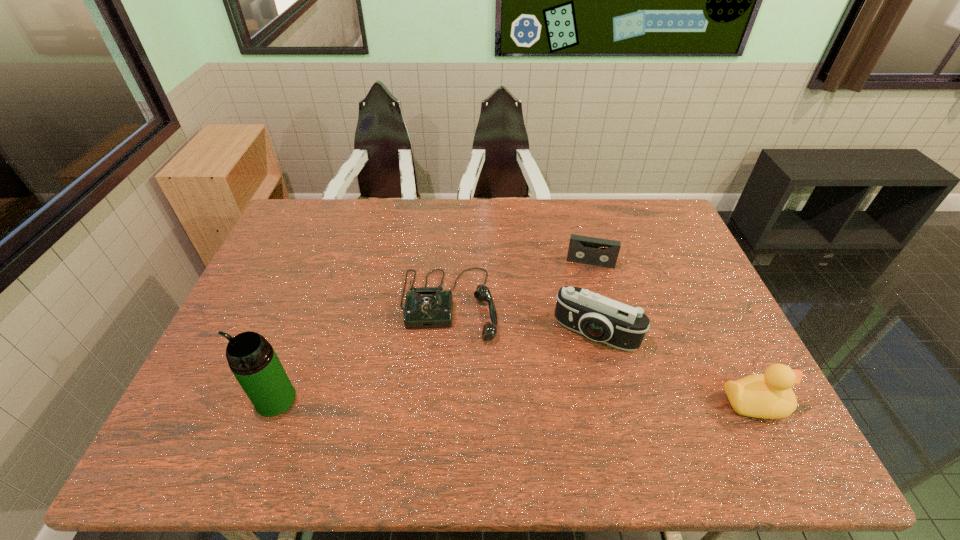
You are a GUI agent. You are given a task and a screenshot of the screen. Output one action in this format:
    pyautogui.click(x=<x>, y=<y>)
    Task: Click on the duck that is positioned at the near edge
    
    Given the screenshot: What is the action you would take?
    pyautogui.click(x=769, y=395)

Locate an element on the screen. This screenshot has height=540, width=960. object present at the left edge is located at coordinates (251, 358).

Locate an element on the screen. object present at the right edge is located at coordinates point(769,395).

Identify the location of object at the near left corner. The height and width of the screenshot is (540, 960). (251, 358).

Locate an element on the screen. The width and height of the screenshot is (960, 540). object that is at the near right corner is located at coordinates (769, 395).

In the image, there is a desktop. Identify the location of vacant space at the far edge. Image resolution: width=960 pixels, height=540 pixels. (439, 228).

Locate an element on the screen. This screenshot has width=960, height=540. free location at the near edge is located at coordinates click(574, 386).

This screenshot has height=540, width=960. In the image, there is a desktop. Identify the location of free region at the left edge. (294, 295).

Identify the location of vacant point at the right edge. This screenshot has width=960, height=540. (720, 314).

This screenshot has height=540, width=960. In the image, there is a desktop. What are the coordinates of `vacant space at the far left corner` in the screenshot? It's located at 297,212.